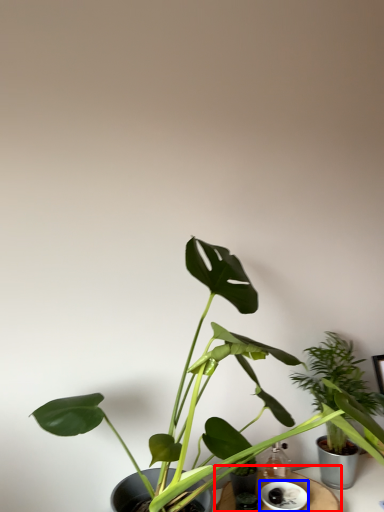
Question: Which point is further to the camera, table (highlighted by a red box) or saucer (highlighted by a blue box)?

Choices:
 (A) table
 (B) saucer

Answer: (B)